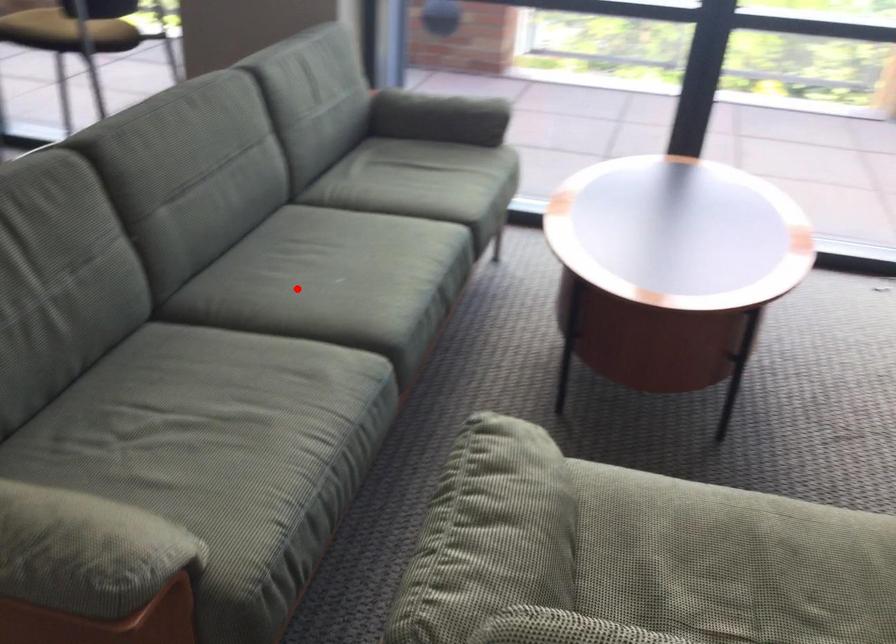
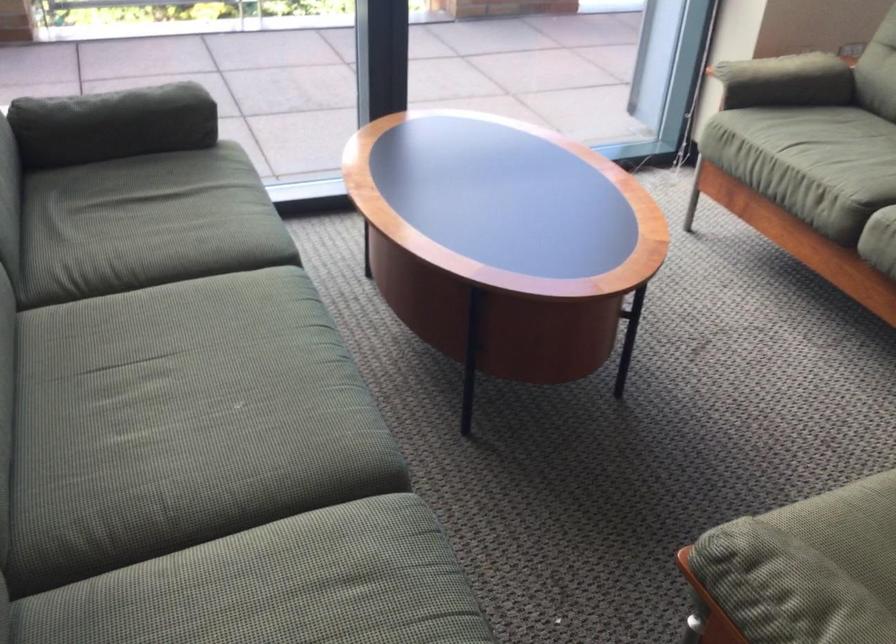
Where in the second image is the point corresponding to the highlighted location from the first image?

(197, 446)